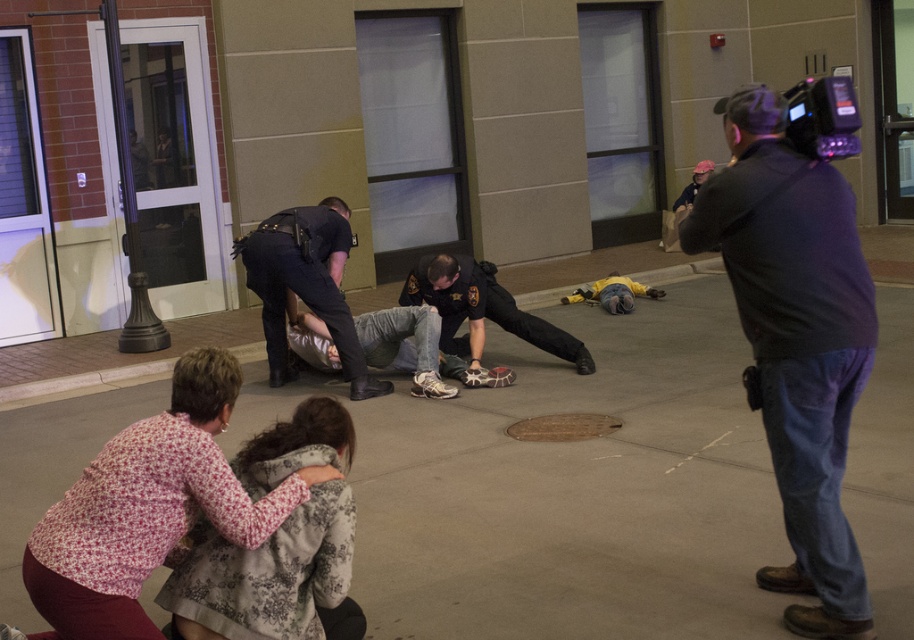
Who is lower down, black fabric camera at right or black plastic video camera at upper right?

black fabric camera at right

Is black fabric camera at right to the left of black plastic video camera at upper right from the viewer's perspective?

Indeed, black fabric camera at right is positioned on the left side of black plastic video camera at upper right.

Is point (845, 529) farther from viewer compared to point (827, 118)?

Yes, it is behind point (827, 118).

Locate an element on the screen. black fabric camera at right is located at coordinates (796, 340).

Is concrete at center positioned in front of black fabric camera at right?

No, concrete at center is behind black fabric camera at right.

What do you see at coordinates (566, 486) in the screenshot? I see `concrete at center` at bounding box center [566, 486].

Is point (912, 380) more distant than point (837, 205)?

Yes, point (912, 380) is behind point (837, 205).

Where is `concrete at center`? The width and height of the screenshot is (914, 640). concrete at center is located at coordinates (566, 486).

Locate an element on the screen. dark blue uniform at center is located at coordinates (305, 285).

The height and width of the screenshot is (640, 914). Find the location of `dark blue uniform at center`. dark blue uniform at center is located at coordinates (305, 285).